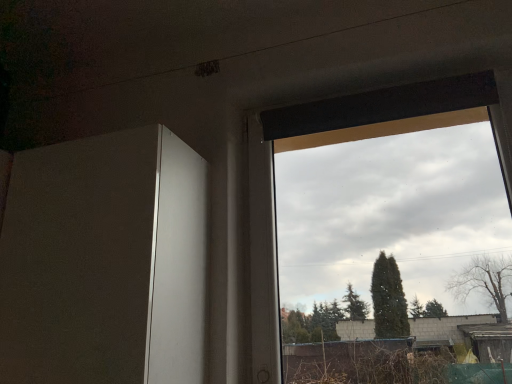
The width and height of the screenshot is (512, 384). What do you see at coordinates (105, 262) in the screenshot? I see `white glossy door at left` at bounding box center [105, 262].

Locate an element on the screen. This screenshot has width=512, height=384. white glossy door at left is located at coordinates (105, 262).

In the scene shown: Measure the distance between point (x=170, y=231) and camera.

Point (x=170, y=231) and camera are 3.66 feet apart.

Where is `white glossy door at left`? white glossy door at left is located at coordinates (105, 262).